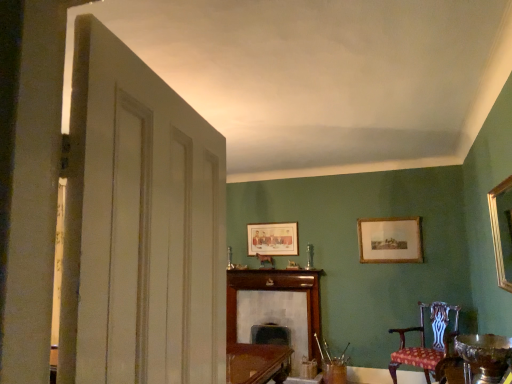
Question: Can you confirm if patterned fabric chair at lower right is thinner than matte wooden picture frame at center, placed as the first picture frame when sorted from back to front?

Choices:
 (A) yes
 (B) no

Answer: (B)

Question: Does patterned fabric chair at lower right turn towards matte wooden picture frame at center, marked as the 1th picture frame in a left-to-right arrangement?

Choices:
 (A) no
 (B) yes

Answer: (A)

Question: Could matte wooden picture frame at center, placed as the first picture frame when sorted from back to front, be considered to be inside patterned fabric chair at lower right?

Choices:
 (A) no
 (B) yes

Answer: (A)

Question: Would you say patterned fabric chair at lower right is outside matte wooden picture frame at center, placed as the first picture frame when sorted from back to front?

Choices:
 (A) yes
 (B) no

Answer: (A)

Question: Are patterned fabric chair at lower right and matte wooden picture frame at center, the 3th picture frame positioned from the right, making contact?

Choices:
 (A) no
 (B) yes

Answer: (A)

Question: Is gold wooden picture frame at upper right, the second picture frame in the right-to-left sequence, situated inside white painted wood door at left or outside?

Choices:
 (A) outside
 (B) inside

Answer: (A)

Question: In terms of height, does gold wooden picture frame at upper right, the second picture frame positioned from the left, look taller or shorter compared to white painted wood door at left?

Choices:
 (A) tall
 (B) short

Answer: (B)

Question: Is gold wooden picture frame at upper right, the second picture frame positioned from the left, wider or thinner than white painted wood door at left?

Choices:
 (A) thin
 (B) wide

Answer: (A)

Question: In terms of size, does gold wooden picture frame at upper right, the second picture frame in the right-to-left sequence, appear bigger or smaller than white painted wood door at left?

Choices:
 (A) small
 (B) big

Answer: (A)

Question: Would you say white painted wood door at left is to the left or to the right of patterned fabric chair at lower right in the picture?

Choices:
 (A) left
 (B) right

Answer: (A)

Question: From a real-world perspective, is white painted wood door at left positioned above or below patterned fabric chair at lower right?

Choices:
 (A) above
 (B) below

Answer: (A)

Question: Is white painted wood door at left taller or shorter than patterned fabric chair at lower right?

Choices:
 (A) tall
 (B) short

Answer: (B)

Question: Which is correct: white painted wood door at left is inside patterned fabric chair at lower right, or outside of it?

Choices:
 (A) outside
 (B) inside

Answer: (A)

Question: Considering the positions of gold-framed print at upper right, positioned as the third picture frame in left-to-right order, and shiny silver bowl at lower right in the image, is gold-framed print at upper right, positioned as the third picture frame in left-to-right order, taller or shorter than shiny silver bowl at lower right?

Choices:
 (A) tall
 (B) short

Answer: (A)

Question: Which is correct: gold-framed print at upper right, the first picture frame from the right, is inside shiny silver bowl at lower right, or outside of it?

Choices:
 (A) inside
 (B) outside

Answer: (B)